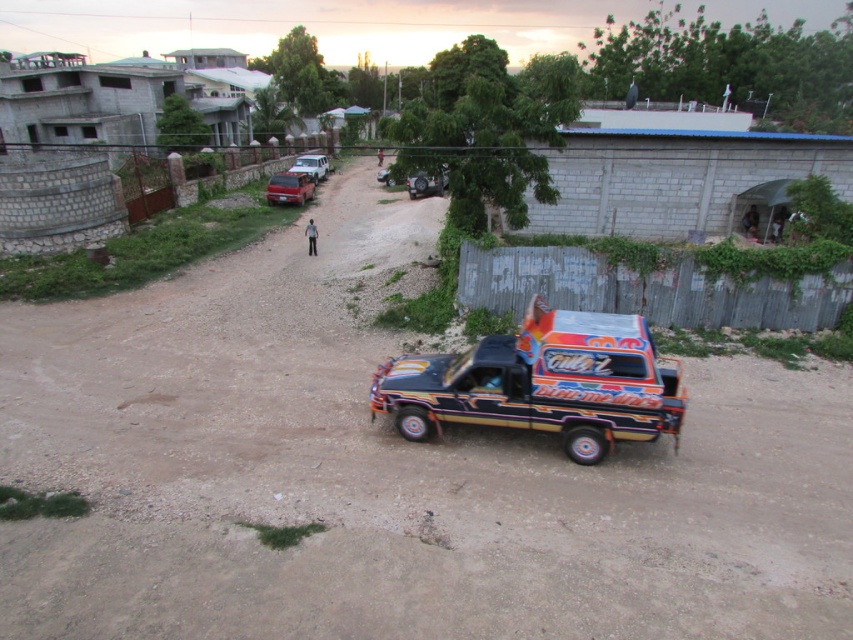
You are a photographer trying to capture both the metallic red car at upper left and the white matte car at upper center in a single frame. Given their sizes in the image, which car would appear smaller in your photo?

The metallic red car at upper left appears smaller in the photo because it is shorter than the white matte car at upper center.

You are a photographer trying to capture both the painted wood monster truck at center and the metallic red car at upper left in the same frame. Given their heights, which vehicle should you position closer to the camera to ensure both are fully visible in the photo?

Since the painted wood monster truck at center is taller than the metallic red car at upper left, you should position the painted wood monster truck at center closer to the camera to ensure both vehicles are fully visible in the photo.